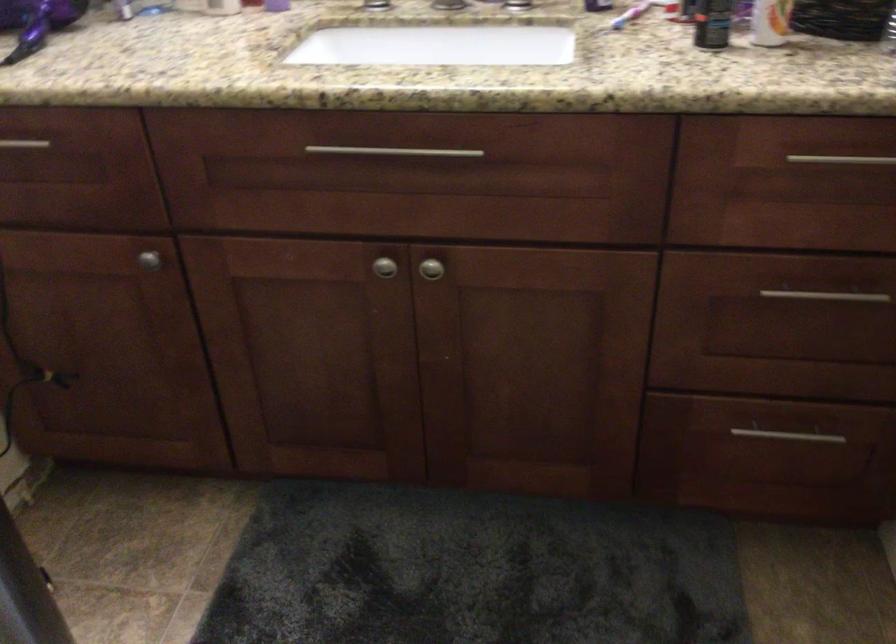
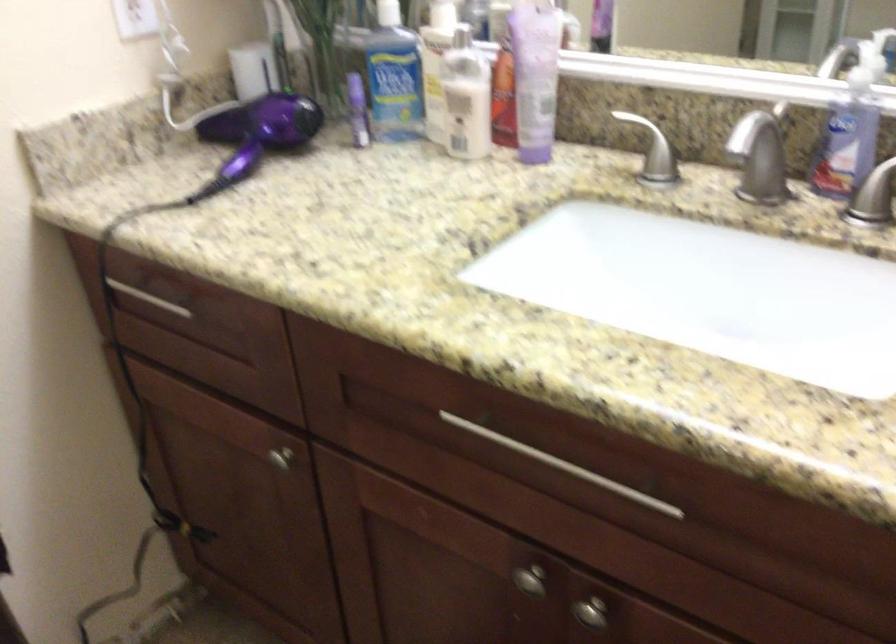
Question: In a continuous first-person perspective shot, in which direction is the camera moving?

Choices:
 (A) Left
 (B) Right
 (C) Forward
 (D) Backward

Answer: (C)